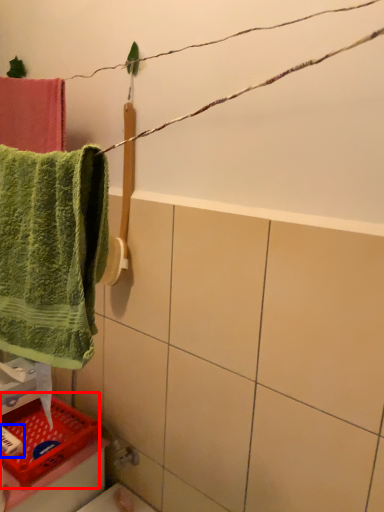
Question: Among these objects, which one is nearest to the camera, basket (highlighted by a red box) or toiletry (highlighted by a blue box)?

Choices:
 (A) basket
 (B) toiletry

Answer: (A)